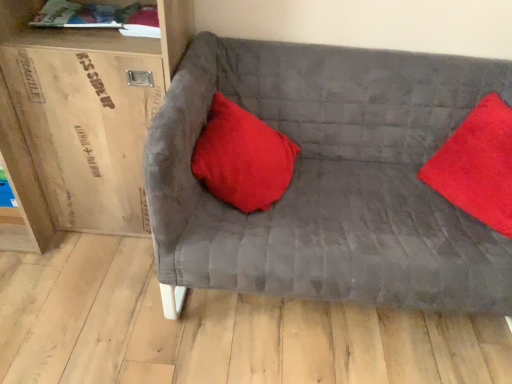
Question: Is wooden cardboard box at left closer to camera compared to velvet gray couch at center?

Choices:
 (A) no
 (B) yes

Answer: (A)

Question: From a real-world perspective, is wooden cardboard box at left over velvet gray couch at center?

Choices:
 (A) yes
 (B) no

Answer: (A)

Question: Considering the relative sizes of wooden cardboard box at left and velvet gray couch at center in the image provided, is wooden cardboard box at left bigger than velvet gray couch at center?

Choices:
 (A) yes
 (B) no

Answer: (B)

Question: Does wooden cardboard box at left have a smaller size compared to velvet gray couch at center?

Choices:
 (A) no
 (B) yes

Answer: (B)

Question: From the image's perspective, is wooden cardboard box at left below velvet gray couch at center?

Choices:
 (A) no
 (B) yes

Answer: (A)

Question: Is wooden cardboard box at left wider than velvet gray couch at center?

Choices:
 (A) yes
 (B) no

Answer: (B)

Question: From a real-world perspective, is velvet red pillow at right, acting as the 1th pillow starting from the right, located higher than hardcover book at upper left?

Choices:
 (A) no
 (B) yes

Answer: (A)

Question: Does velvet red pillow at right, the 2th pillow from the left, appear on the left side of hardcover book at upper left?

Choices:
 (A) yes
 (B) no

Answer: (B)

Question: Is velvet red pillow at right, acting as the 1th pillow starting from the right, further to the viewer compared to hardcover book at upper left?

Choices:
 (A) yes
 (B) no

Answer: (B)

Question: Is velvet red pillow at right, the 2th pillow from the left, next to hardcover book at upper left?

Choices:
 (A) yes
 (B) no

Answer: (B)

Question: Is hardcover book at upper left located within velvet red pillow at right, acting as the 1th pillow starting from the right?

Choices:
 (A) yes
 (B) no

Answer: (B)

Question: From a real-world perspective, is velvet red pillow at right, the 2th pillow from the left, beneath hardcover book at upper left?

Choices:
 (A) yes
 (B) no

Answer: (A)

Question: Considering the relative sizes of wooden cardboard box at left and satin red pillow at center, the second pillow positioned from the right, in the image provided, is wooden cardboard box at left wider than satin red pillow at center, the second pillow positioned from the right,?

Choices:
 (A) yes
 (B) no

Answer: (A)